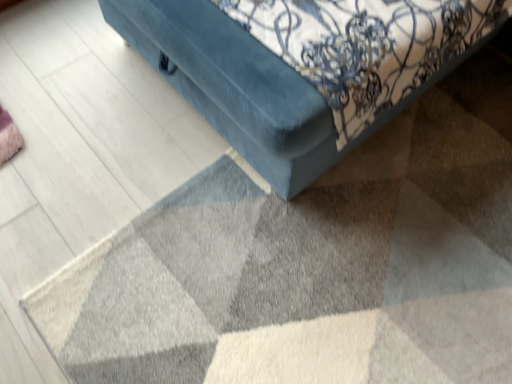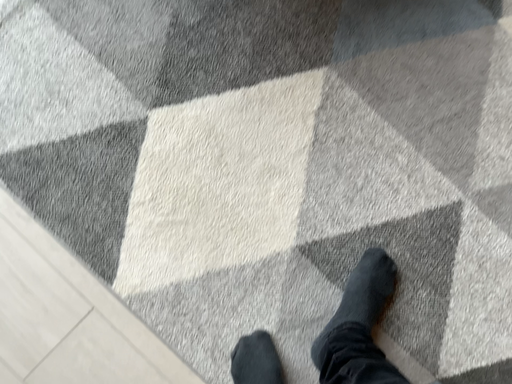
Question: How did the camera likely rotate when shooting the video?

Choices:
 (A) rotated upward
 (B) rotated downward

Answer: (B)